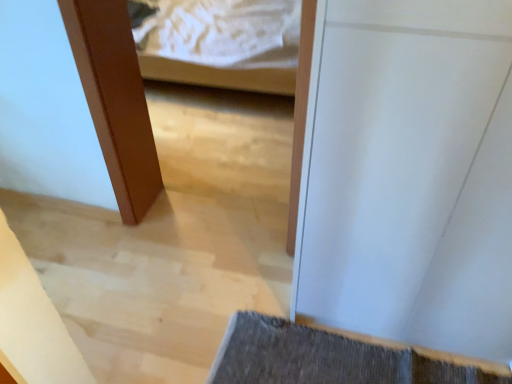
What do you see at coordinates (410, 174) in the screenshot? I see `white glossy door at center` at bounding box center [410, 174].

Where is `white glossy door at center`? white glossy door at center is located at coordinates (410, 174).

The image size is (512, 384). What do you see at coordinates (324, 358) in the screenshot?
I see `dark gray textured bath mat at lower right` at bounding box center [324, 358].

Find the location of `dark gray textured bath mat at lower right`. dark gray textured bath mat at lower right is located at coordinates [x=324, y=358].

In order to face dark gray textured bath mat at lower right, should I rotate leftwards or rightwards?

Rotate right and turn 13.410 degrees.

You are a GUI agent. You are given a task and a screenshot of the screen. Output one action in this format:
    pyautogui.click(x=<x>, y=<y>)
    Task: Click on the white glossy door at center
    The height and width of the screenshot is (384, 512).
    Given the screenshot: What is the action you would take?
    pyautogui.click(x=410, y=174)

Is dark gray textured bath mat at lower right to the left or to the right of white glossy door at center in the image?

dark gray textured bath mat at lower right is positioned on white glossy door at center's left side.

Considering the positions of objects dark gray textured bath mat at lower right and white glossy door at center in the image provided, who is behind, dark gray textured bath mat at lower right or white glossy door at center?

dark gray textured bath mat at lower right is behind.

Which is in front, point (282, 324) or point (479, 330)?

Point (479, 330)

From the image's perspective, relative to white glossy door at center, is dark gray textured bath mat at lower right above or below?

From the image's perspective, dark gray textured bath mat at lower right appears below white glossy door at center.

From a real-world perspective, which object stands above the other?

white glossy door at center.

Can you confirm if dark gray textured bath mat at lower right is thinner than white glossy door at center?

No.

Does dark gray textured bath mat at lower right have a lesser height compared to white glossy door at center?

Yes.

Considering the relative sizes of dark gray textured bath mat at lower right and white glossy door at center in the image provided, is dark gray textured bath mat at lower right bigger than white glossy door at center?

No, dark gray textured bath mat at lower right is not bigger than white glossy door at center.

Which is correct: dark gray textured bath mat at lower right is inside white glossy door at center, or outside of it?

dark gray textured bath mat at lower right exists outside the volume of white glossy door at center.

Are dark gray textured bath mat at lower right and white glossy door at center located far from each other?

dark gray textured bath mat at lower right is near white glossy door at center, not far away.

Does dark gray textured bath mat at lower right turn towards white glossy door at center?

No, dark gray textured bath mat at lower right is not turned towards white glossy door at center.

How different are the orientations of dark gray textured bath mat at lower right and white glossy door at center in degrees?

They differ by 1.9 degrees in their facing directions.

Identify the location of door located above the dark gray textured bath mat at lower right (from the image's perspective). The height and width of the screenshot is (384, 512). (410, 174).

Is white glossy door at center to the left or to the right of dark gray textured bath mat at lower right in the image?

Based on their positions, white glossy door at center is located to the right of dark gray textured bath mat at lower right.

In the image, is white glossy door at center positioned in front of or behind dark gray textured bath mat at lower right?

Clearly, white glossy door at center is in front of dark gray textured bath mat at lower right.

Considering the points (458, 239) and (450, 377), which point is behind, point (458, 239) or point (450, 377)?

The point (450, 377) is more distant.

From the image's perspective, would you say white glossy door at center is positioned over dark gray textured bath mat at lower right?

Yes, from the image's perspective, white glossy door at center is on top of dark gray textured bath mat at lower right.

From a real-world perspective, is white glossy door at center physically located above or below dark gray textured bath mat at lower right?

In terms of real-world spatial position, white glossy door at center is above dark gray textured bath mat at lower right.

Which object is wider, white glossy door at center or dark gray textured bath mat at lower right?

Wider between the two is dark gray textured bath mat at lower right.

Considering the sizes of objects white glossy door at center and dark gray textured bath mat at lower right in the image provided, who is shorter, white glossy door at center or dark gray textured bath mat at lower right?

Result: With less height is dark gray textured bath mat at lower right.

In terms of size, does white glossy door at center appear bigger or smaller than dark gray textured bath mat at lower right?

white glossy door at center is bigger than dark gray textured bath mat at lower right.

Is white glossy door at center outside of dark gray textured bath mat at lower right?

white glossy door at center lies outside dark gray textured bath mat at lower right's area.

Is white glossy door at center far away from dark gray textured bath mat at lower right?

They are positioned close to each other.

Is dark gray textured bath mat at lower right at the back of white glossy door at center?

No, white glossy door at center's orientation is not away from dark gray textured bath mat at lower right.

Can you tell me how much white glossy door at center and dark gray textured bath mat at lower right differ in facing direction?

1.9 degrees.

At what (x,y) coordinates should I click in order to perform the action: click on bath mat that appears on the left of white glossy door at center. Please return your answer as a coordinate pair (x, y). The height and width of the screenshot is (384, 512). Looking at the image, I should click on (324, 358).

The width and height of the screenshot is (512, 384). I want to click on door in front of the dark gray textured bath mat at lower right, so click(410, 174).

You are a GUI agent. You are given a task and a screenshot of the screen. Output one action in this format:
    pyautogui.click(x=<x>, y=<y>)
    Task: Click on the bath mat below the white glossy door at center (from a real-world perspective)
    Image resolution: width=512 pixels, height=384 pixels.
    Given the screenshot: What is the action you would take?
    pyautogui.click(x=324, y=358)